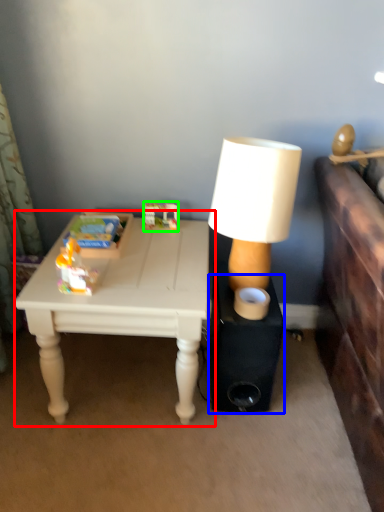
Question: Considering the real-world distances, which object is farthest from table (highlighted by a red box)? speaker (highlighted by a blue box) or toy (highlighted by a green box)?

Choices:
 (A) speaker
 (B) toy

Answer: (B)